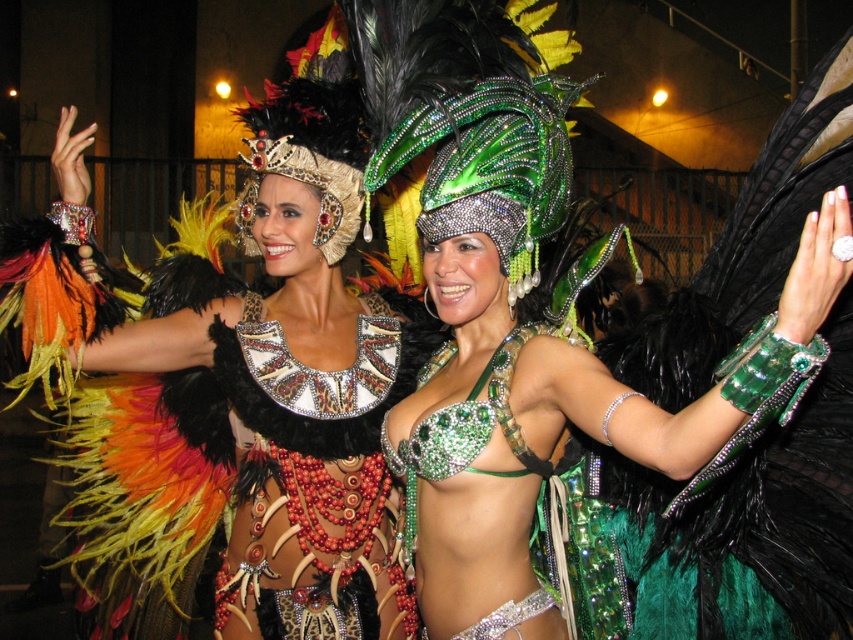
Question: Where is green shiny headdress at center located in relation to leather/embellished dress at center in the image?

Choices:
 (A) left
 (B) right

Answer: (B)

Question: Among these points, which one is farthest from the camera?

Choices:
 (A) (370, 323)
 (B) (302, 632)
 (C) (592, 532)

Answer: (A)

Question: Which point is farther from the camera taking this photo?

Choices:
 (A) (816, 448)
 (B) (260, 538)

Answer: (B)

Question: Is green shiny headdress at center to the right of leather/embellished dress at center from the viewer's perspective?

Choices:
 (A) yes
 (B) no

Answer: (A)

Question: Which is farther from the green shiny headdress at center?

Choices:
 (A) shiny metallic headdress at upper center
 (B) leather/embellished dress at center

Answer: (A)

Question: Does shiny metallic headdress at upper center appear on the right side of leather/embellished dress at center?

Choices:
 (A) no
 (B) yes

Answer: (A)